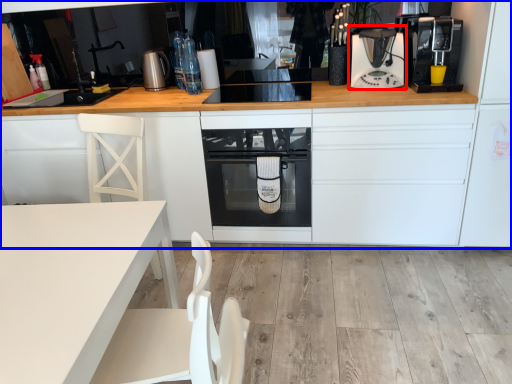
Question: Which object appears closest to the camera in this image, kitchen appliance (highlighted by a red box) or cabinetry (highlighted by a blue box)?

Choices:
 (A) kitchen appliance
 (B) cabinetry

Answer: (B)